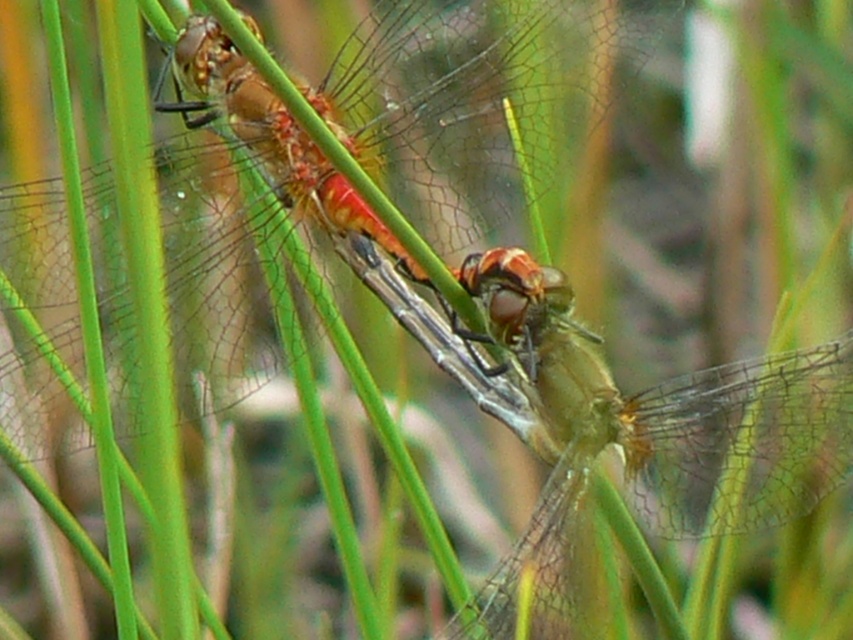
In the scene shown: What is the color of the dragonfly located at the coordinates point (457, 122)?

The dragonfly at point (457, 122) is translucent orange.